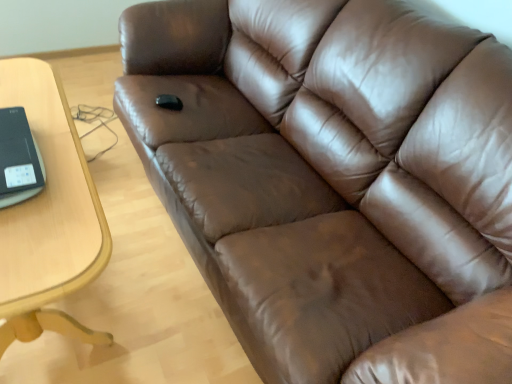
Describe the element at coordinates (49, 216) in the screenshot. I see `light wood table at left` at that location.

At what (x,y) coordinates should I click in order to perform the action: click on light wood table at left. Please return your answer as a coordinate pair (x, y). Looking at the image, I should click on point(49,216).

Locate an element on the screen. This screenshot has width=512, height=384. light wood table at left is located at coordinates (49, 216).